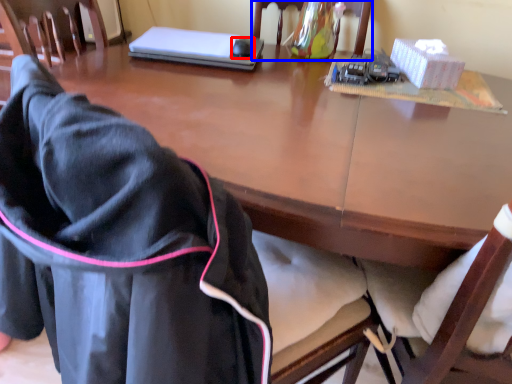
Question: Which object appears closest to the camera in this image, mouse (highlighted by a red box) or chair (highlighted by a blue box)?

Choices:
 (A) mouse
 (B) chair

Answer: (B)